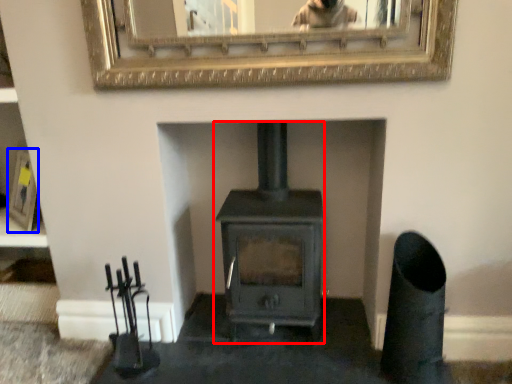
Question: Which object appears farthest to the camera in this image, wood burning stove (highlighted by a red box) or picture frame (highlighted by a blue box)?

Choices:
 (A) wood burning stove
 (B) picture frame

Answer: (B)